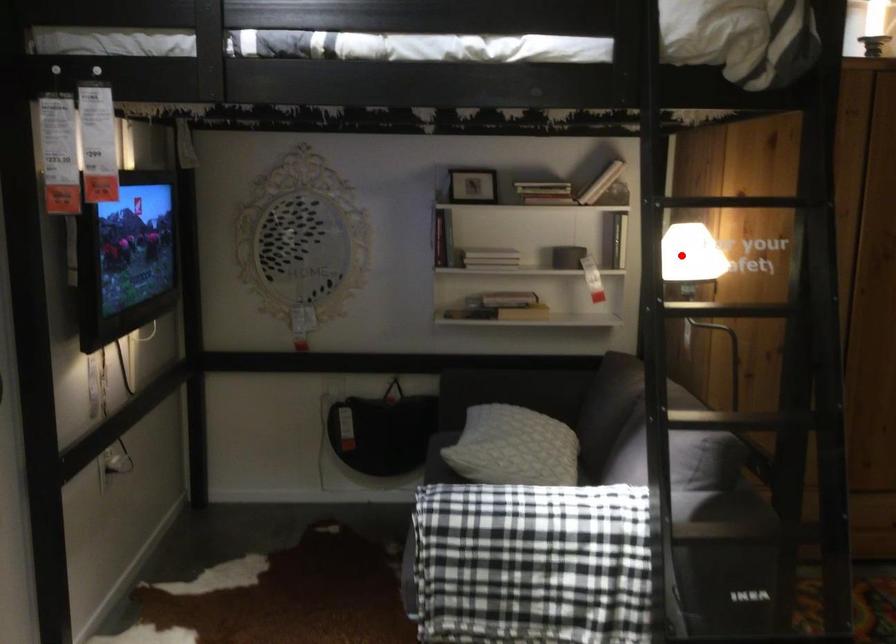
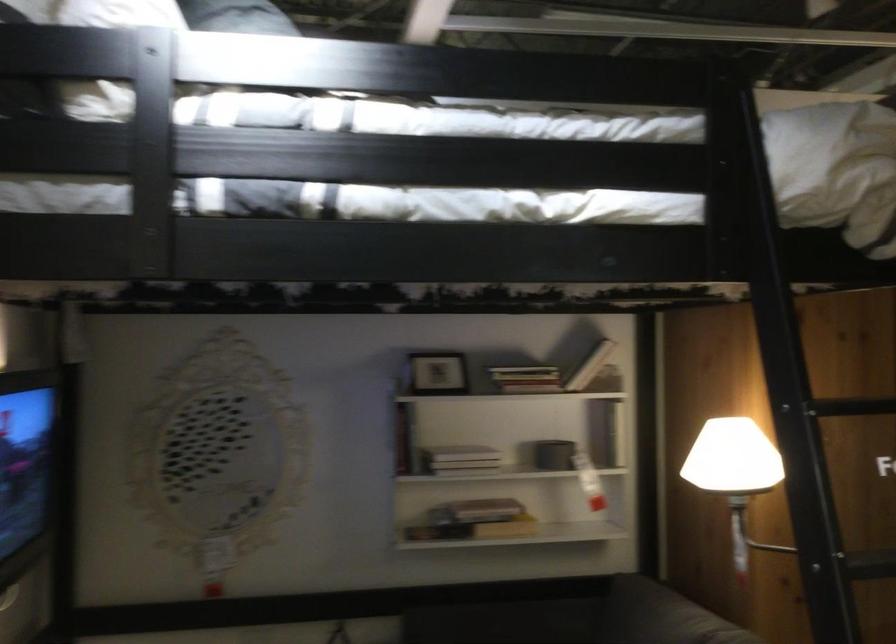
Find the pixel in the second image that matches the highlighted location in the first image.

(736, 474)